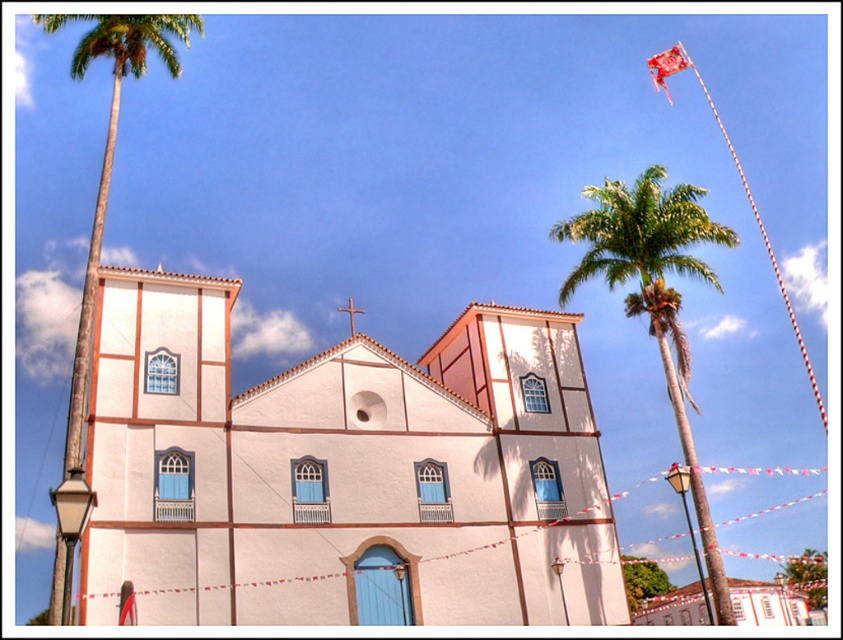
You are a photographer planning to capture the white matte church at center and the green leafy palm tree at left in a single shot. Based on their sizes in the image, which object should you focus on first to ensure both are in frame?

The white matte church at center occupies less space than the green leafy palm tree at left, so you should focus on the larger green leafy palm tree at left first to ensure both fit in the frame.

You are standing in front of the two story building with a cross on the roof. You notice a point marked at coordinate [341,472]. What object does this point correspond to?

The point at coordinate [341,472] corresponds to the white matte church at center.